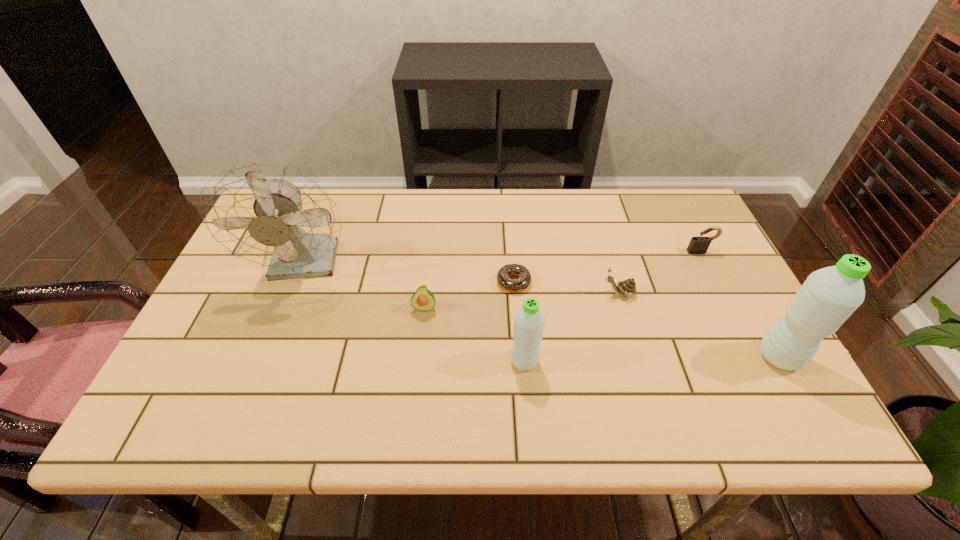
Locate an element on the screen. The height and width of the screenshot is (540, 960). padlock is located at coordinates (698, 245).

The image size is (960, 540). Identify the location of free region located 0.060m on the back of the shorter water bottle. 521,329.

In order to click on free space located 0.300m on the back of the sixth shortest object in this screenshot , I will do `click(721, 253)`.

Image resolution: width=960 pixels, height=540 pixels. I want to click on free region located 0.230m in front of the fan to blow air, so click(x=264, y=375).

Where is `free space located on the face of the fifth object from left to right`? The image size is (960, 540). free space located on the face of the fifth object from left to right is located at coordinates (519, 294).

Where is `free point located 0.310m on the face of the fifth object from left to right`? This screenshot has width=960, height=540. free point located 0.310m on the face of the fifth object from left to right is located at coordinates (481, 294).

Locate an element on the screen. The height and width of the screenshot is (540, 960). free location located on the face of the fifth object from left to right is located at coordinates (508, 294).

The height and width of the screenshot is (540, 960). Identify the location of vacant point located on the cut side of the third nearest object. (418, 366).

At what (x,y) coordinates should I click in order to perform the action: click on free space located on the left of the doughnut. Please return your answer as a coordinate pair (x, y). This screenshot has width=960, height=540. Looking at the image, I should click on (424, 282).

Identify the location of vacant area situated with the keyhole on the front of the padlock. This screenshot has height=540, width=960. click(765, 380).